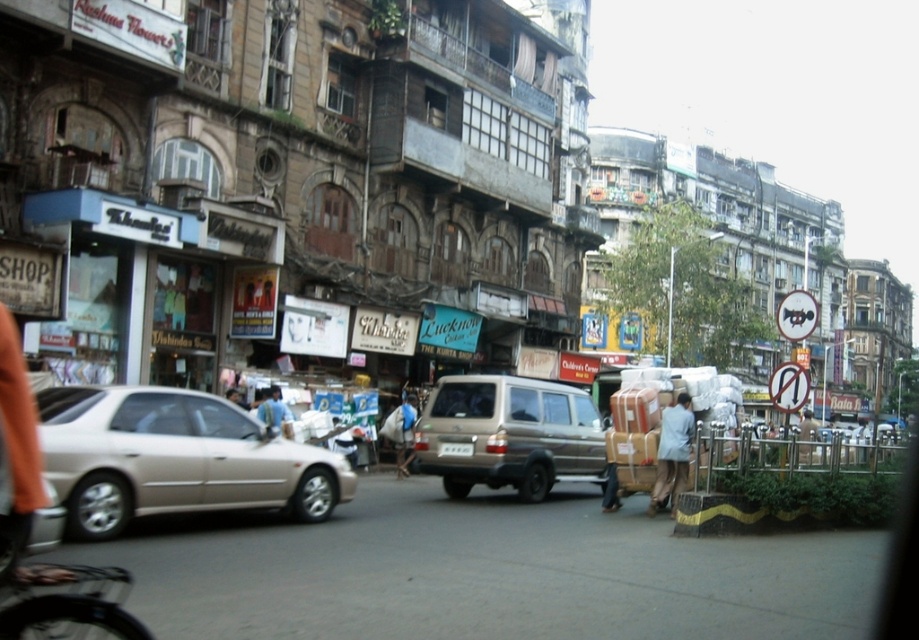
You are a pedestrian walking down the street and you see a blue fabric bag at center and a light blue shirt at center. Which item is covering the other one?

The blue fabric bag at center is positioned over the light blue shirt at center, so the bag is covering the shirt.

You are standing at the center of the street in the image. Which direction should you walk to reach the matte beige sedan at left?

You should walk to the left to reach the matte beige sedan at left since it is located at the left side of the image.